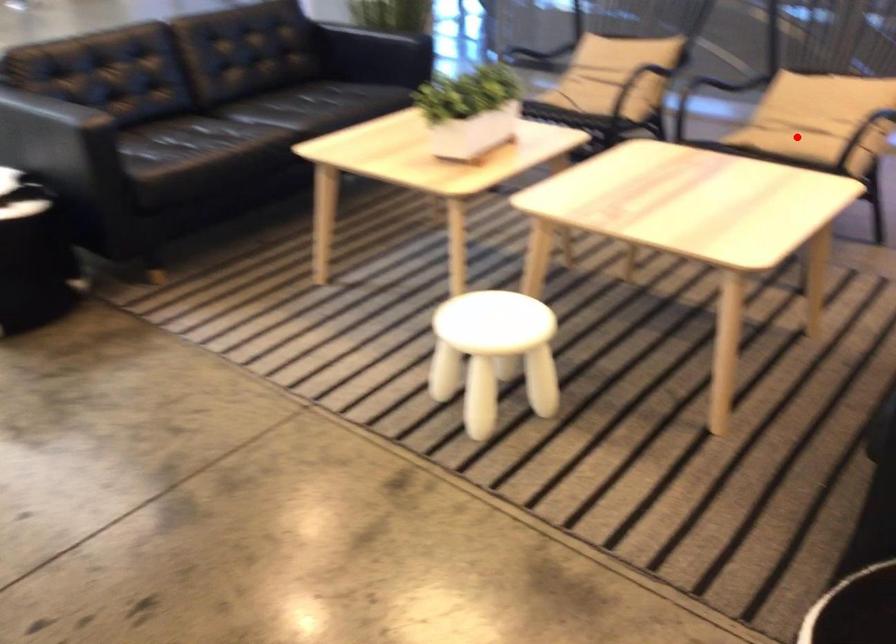
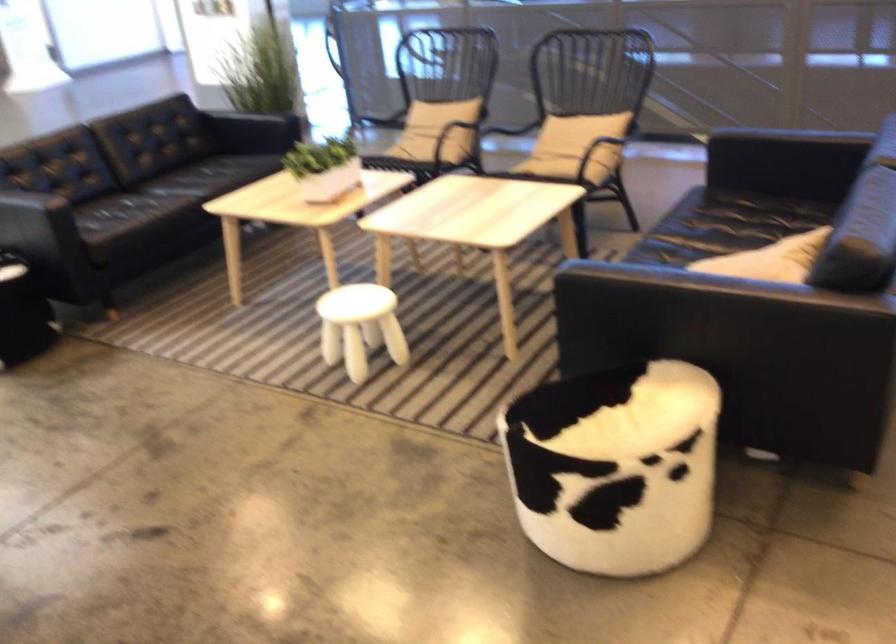
Question: I am providing you with two images of the same scene from different viewpoints. Image1 has a red point marked. In image2, the corresponding 3D location appears at what relative position? Reply with the corresponding letter.

Choices:
 (A) Closer
 (B) Farther

Answer: (B)